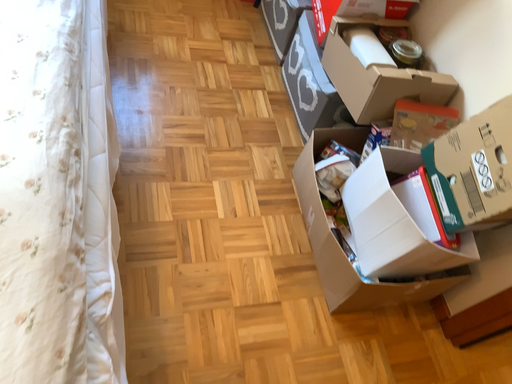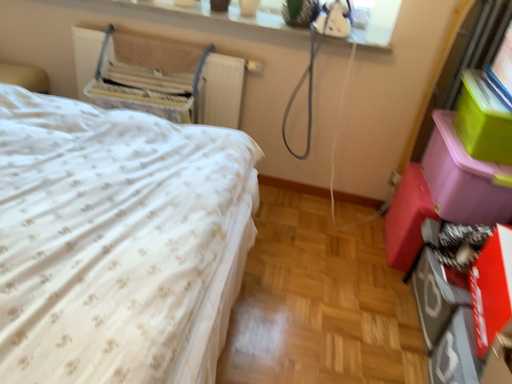
Question: Which way did the camera rotate in the video?

Choices:
 (A) rotated right
 (B) rotated left

Answer: (B)